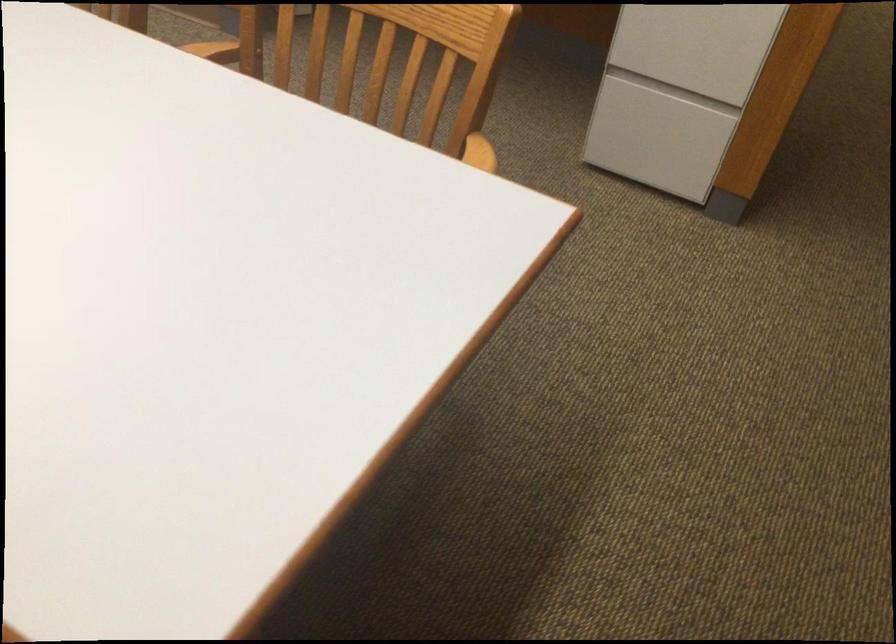
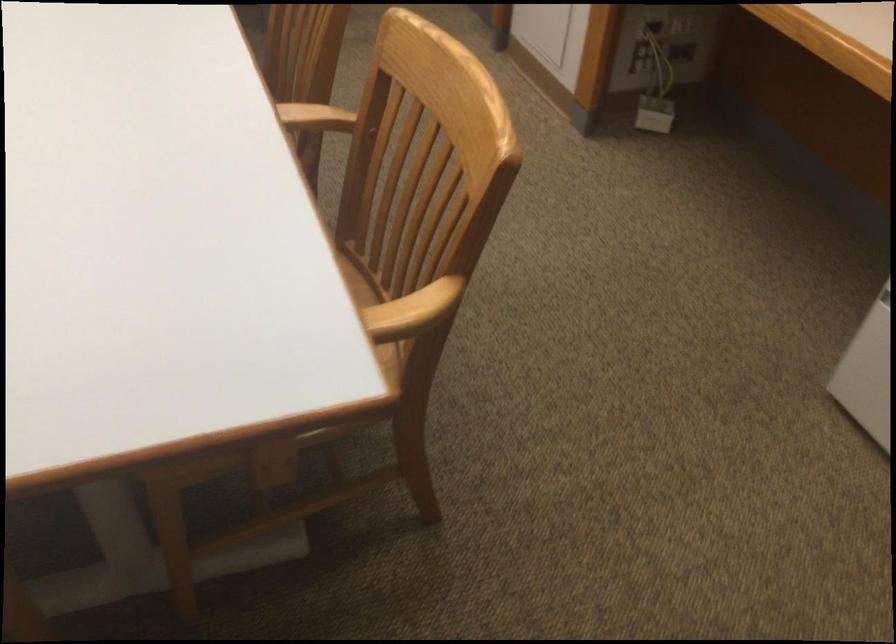
Question: The camera is either moving clockwise (left) or counter-clockwise (right) around the object. The first image is from the beginning of the video and the second image is from the end. Is the camera moving left or right when shooting the video?

Choices:
 (A) Left
 (B) Right

Answer: (B)